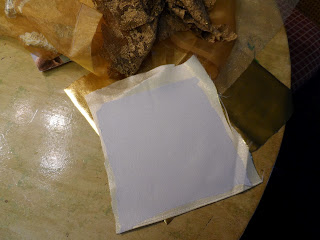
Image resolution: width=320 pixels, height=240 pixels. Identify the location of tulle. (273, 19).